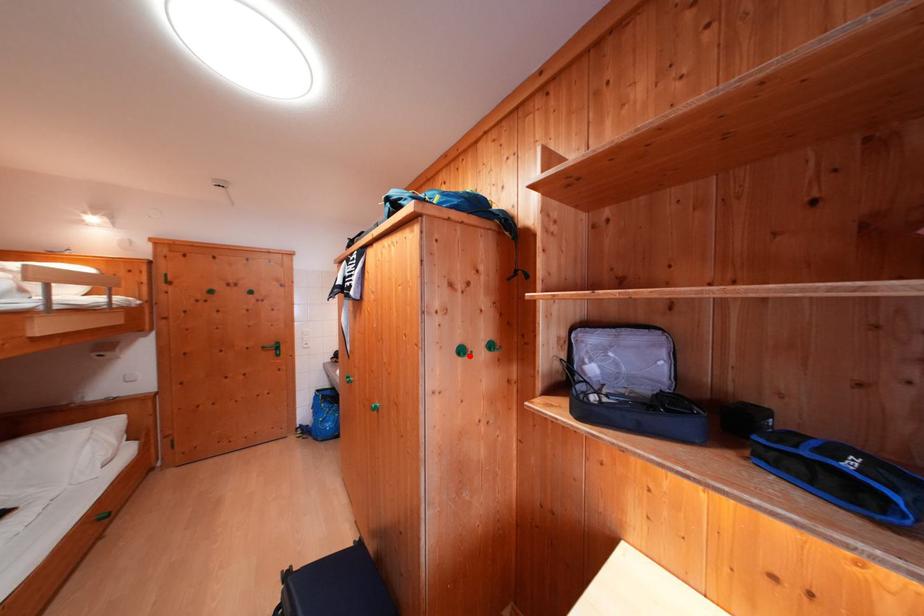
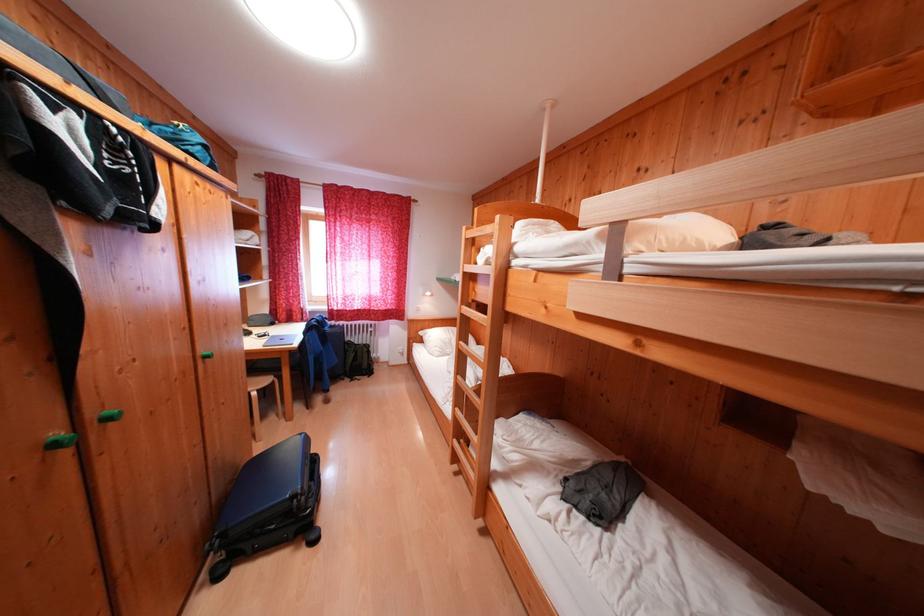
Question: I am providing you with two images of the same scene from different viewpoints. A red point is marked on the first image. At the location where the point appears in image 1, is it still visible in image 2?

Choices:
 (A) Yes
 (B) No

Answer: (B)